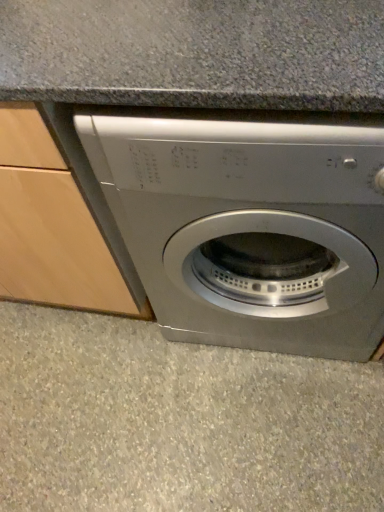
Question: From a real-world perspective, is gray speckled concrete at lower center positioned above or below satin silver washing machine at center?

Choices:
 (A) below
 (B) above

Answer: (A)

Question: Relative to satin silver washing machine at center, is gray speckled concrete at lower center in front or behind?

Choices:
 (A) behind
 (B) front

Answer: (A)

Question: Do you think gray speckled concrete at lower center is within satin silver washing machine at center, or outside of it?

Choices:
 (A) outside
 (B) inside

Answer: (A)

Question: Is satin silver washing machine at center to the left or to the right of gray speckled concrete at lower center in the image?

Choices:
 (A) left
 (B) right

Answer: (B)

Question: From the image's perspective, is satin silver washing machine at center positioned above or below gray speckled concrete at lower center?

Choices:
 (A) below
 (B) above

Answer: (B)

Question: Is satin silver washing machine at center situated inside gray speckled concrete at lower center or outside?

Choices:
 (A) inside
 (B) outside

Answer: (B)

Question: Is satin silver washing machine at center bigger or smaller than gray speckled concrete at lower center?

Choices:
 (A) big
 (B) small

Answer: (A)